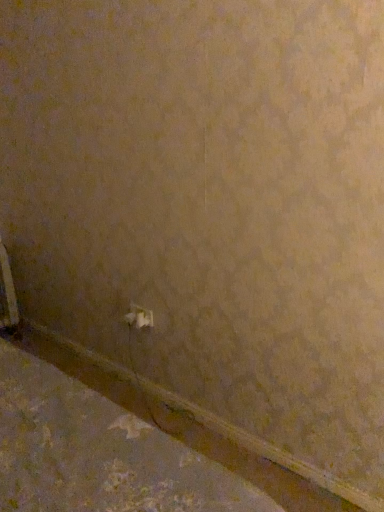
Question: From the image's perspective, relative to white plastic power plug at center, is white plastic radiator at lower left above or below?

Choices:
 (A) below
 (B) above

Answer: (B)

Question: Does point (6, 274) appear closer or farther from the camera than point (145, 312)?

Choices:
 (A) farther
 (B) closer

Answer: (A)

Question: Based on their relative distances, which object is farther from the white plastic radiator at lower left?

Choices:
 (A) white plastic power plug at center
 (B) brown matte concrete at lower left

Answer: (B)

Question: Considering the real-world distances, which object is farthest from the white plastic power plug at center?

Choices:
 (A) brown matte concrete at lower left
 (B) white plastic radiator at lower left

Answer: (B)